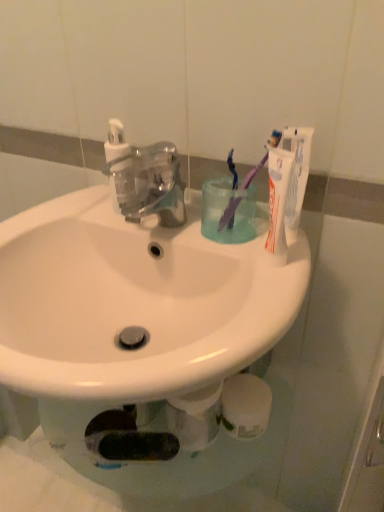
Question: Are translucent plastic cup at center and transparent plastic faucet at center beside each other?

Choices:
 (A) no
 (B) yes

Answer: (A)

Question: From a real-world perspective, is translucent plastic cup at center over transparent plastic faucet at center?

Choices:
 (A) yes
 (B) no

Answer: (B)

Question: Is translucent plastic cup at center thinner than transparent plastic faucet at center?

Choices:
 (A) no
 (B) yes

Answer: (B)

Question: Can you confirm if translucent plastic cup at center is smaller than transparent plastic faucet at center?

Choices:
 (A) no
 (B) yes

Answer: (B)

Question: Is translucent plastic cup at center closer to camera compared to transparent plastic faucet at center?

Choices:
 (A) no
 (B) yes

Answer: (A)

Question: From a real-world perspective, is translucent plastic cup at center below transparent plastic faucet at center?

Choices:
 (A) no
 (B) yes

Answer: (B)

Question: Is the position of transparent plastic soap dispenser at upper left more distant than that of transparent plastic faucet at center?

Choices:
 (A) no
 (B) yes

Answer: (B)

Question: From the image's perspective, is transparent plastic soap dispenser at upper left under transparent plastic faucet at center?

Choices:
 (A) no
 (B) yes

Answer: (A)

Question: Can you confirm if transparent plastic soap dispenser at upper left is shorter than transparent plastic faucet at center?

Choices:
 (A) no
 (B) yes

Answer: (A)

Question: Does transparent plastic soap dispenser at upper left have a larger size compared to transparent plastic faucet at center?

Choices:
 (A) yes
 (B) no

Answer: (B)

Question: Is transparent plastic soap dispenser at upper left smaller than transparent plastic faucet at center?

Choices:
 (A) yes
 (B) no

Answer: (A)

Question: From a real-world perspective, is transparent plastic soap dispenser at upper left physically below transparent plastic faucet at center?

Choices:
 (A) yes
 (B) no

Answer: (B)

Question: From the image's perspective, would you say translucent plastic cup at center is shown under white matte toothpaste at upper right?

Choices:
 (A) yes
 (B) no

Answer: (A)